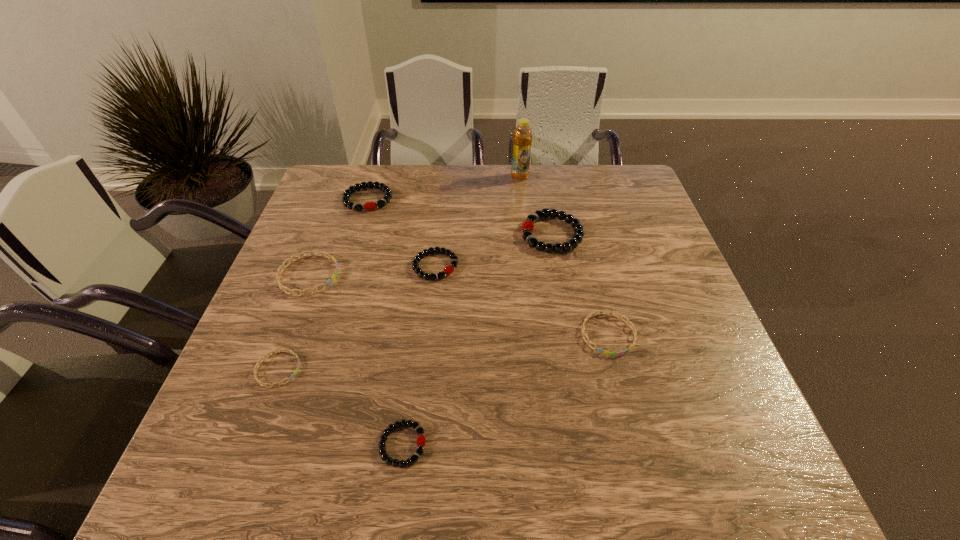
Where is `bottle`? The height and width of the screenshot is (540, 960). bottle is located at coordinates (522, 136).

Identify the location of the tallest object. The image size is (960, 540). (522, 136).

This screenshot has height=540, width=960. Find the location of `the rightmost black bracelet`. the rightmost black bracelet is located at coordinates (528, 226).

The height and width of the screenshot is (540, 960). Find the location of `the tallest bracelet`. the tallest bracelet is located at coordinates (528, 226).

Find the location of a particular element. Image resolution: width=960 pixels, height=540 pixels. the second biggest black bracelet is located at coordinates (348, 192).

Identify the location of the seventh nearest object. tap(348, 192).

The width and height of the screenshot is (960, 540). Find the location of `the farthest blue bracelet`. the farthest blue bracelet is located at coordinates (283, 266).

You are a GUI agent. You are given a task and a screenshot of the screen. Output one action in this format:
    pyautogui.click(x=<x>, y=<y>)
    Task: Click on the second smallest black bracelet
    This screenshot has width=960, height=540.
    Given the screenshot: What is the action you would take?
    pyautogui.click(x=448, y=270)

Find the location of a particular element. the second smallest blue bracelet is located at coordinates (584, 334).

Locate an element on the screen. the smallest black bracelet is located at coordinates click(421, 441).